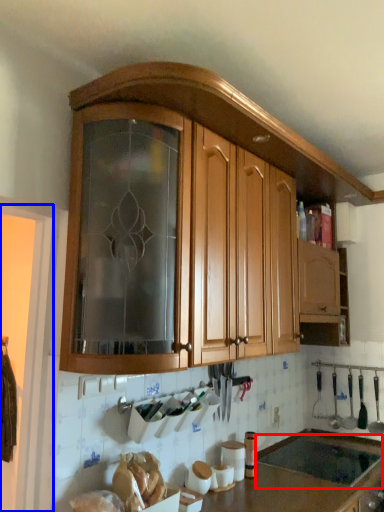
Question: Which object appears farthest to the camera in this image, sink (highlighted by a red box) or screen door (highlighted by a blue box)?

Choices:
 (A) sink
 (B) screen door

Answer: (A)